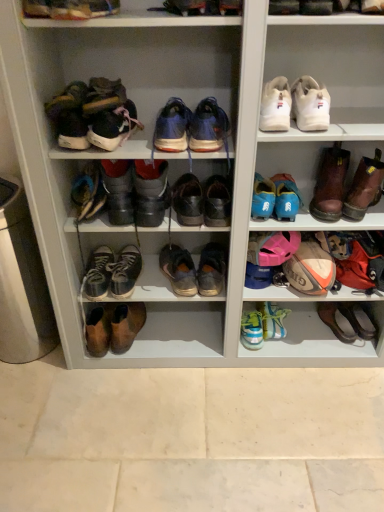
What are the coordinates of `spots to the right of leather boots at center, the 10th footwear from the right` in the screenshot? It's located at (177, 338).